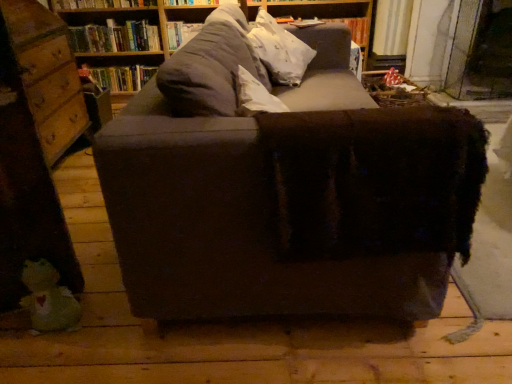
The width and height of the screenshot is (512, 384). I want to click on free space in front of green plush toy at lower left, so click(x=35, y=358).